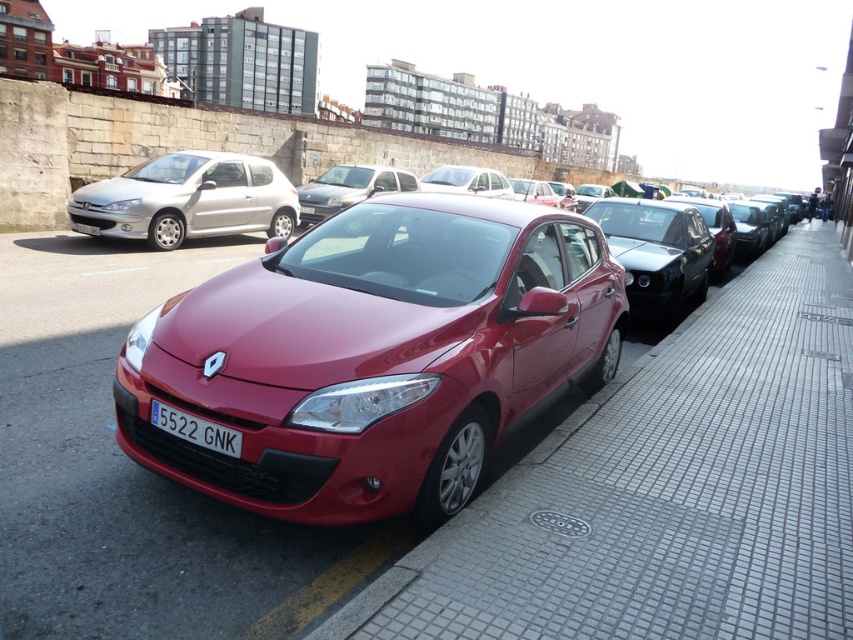
You are a delivery driver who needs to park your vehicle between two sedans in the parking area. The sedans are the satin burgundy sedan at center and the satin black sedan at center. Which sedan should you park to the right side of to ensure proper alignment with the parking area layout?

You should park to the right side of the satin burgundy sedan at center because it is positioned on the left side of the satin black sedan at center, so placing your vehicle next to the satin black sedan at center on its right would maintain alignment with the existing parking layout.

You are a delivery person trying to park your van in the parking area. The van requires a parking space of at least 12 meters. Can you park your van between the gray brick pavement at center and the white glossy sedan at center?

The distance between the gray brick pavement at center and the white glossy sedan at center is 11.04 meters, which is shorter than the required 12 meters. Therefore, the van cannot be parked there.

You are a delivery person standing in front of the satin burgundy sedan at center with a package that requires a clearance of 3 meters to pass. Can you safely move the package past the sedan without hitting it?

The distance between the satin burgundy sedan at center and the viewer is 2.90 meters. Since the required clearance is 3 meters, the package cannot safely pass as the available space is insufficient.